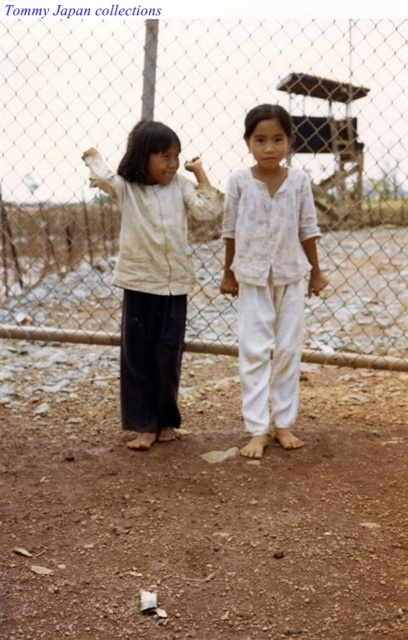
Question: Which of the following is the farthest from the observer?

Choices:
 (A) light beige cotton shirt at center
 (B) brown dirt field at lower center
 (C) white cotton pants at center
 (D) wire mesh fence at center

Answer: (D)

Question: Which of the following is the closest to the observer?

Choices:
 (A) wire mesh fence at center
 (B) light beige cotton shirt at center
 (C) brown dirt field at lower center

Answer: (C)

Question: Does brown dirt field at lower center appear under light beige cotton shirt at center?

Choices:
 (A) yes
 (B) no

Answer: (A)

Question: Considering the real-world distances, which object is closest to the white cotton pants at center?

Choices:
 (A) brown dirt field at lower center
 (B) light beige cotton shirt at center

Answer: (B)

Question: Does wire mesh fence at center appear on the right side of light beige cotton shirt at center?

Choices:
 (A) yes
 (B) no

Answer: (B)

Question: Can you confirm if wire mesh fence at center is positioned below white cotton pants at center?

Choices:
 (A) yes
 (B) no

Answer: (B)